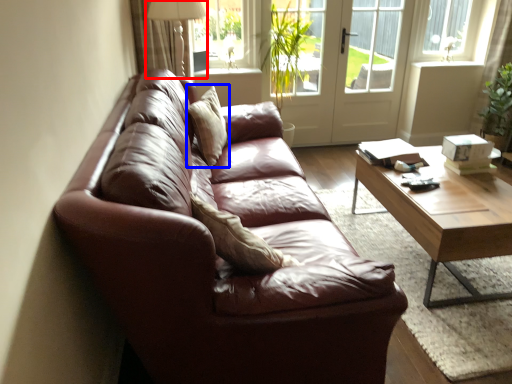
Question: Which object appears farthest to the camera in this image, table lamp (highlighted by a red box) or pillow (highlighted by a blue box)?

Choices:
 (A) table lamp
 (B) pillow

Answer: (A)